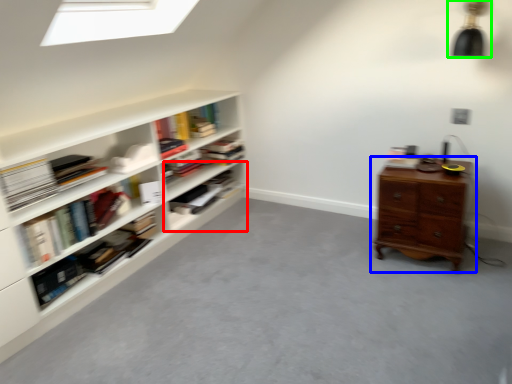
Question: Which is nearer to the shelf (highlighted by a red box)? chest of drawers (highlighted by a blue box) or light fixture (highlighted by a green box).

Choices:
 (A) chest of drawers
 (B) light fixture

Answer: (A)